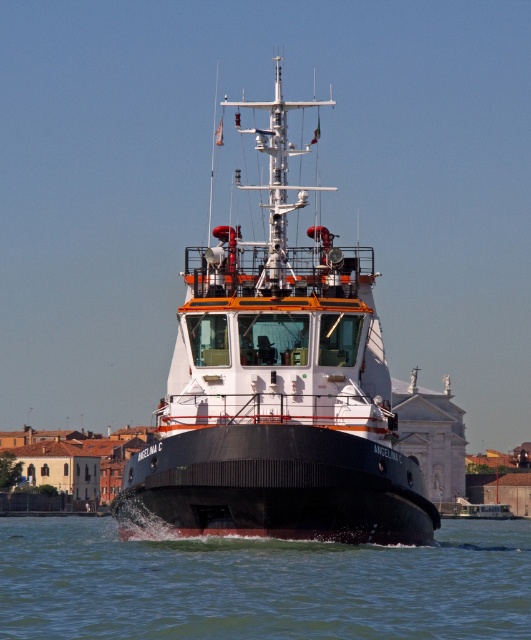
Question: Is matte white ship at center positioned behind brown matte water at lower center?

Choices:
 (A) yes
 (B) no

Answer: (A)

Question: Which point is closer to the camera?

Choices:
 (A) (450, 556)
 (B) (310, 465)

Answer: (B)

Question: Does matte white ship at center come in front of brown matte water at lower center?

Choices:
 (A) yes
 (B) no

Answer: (B)

Question: Does matte white ship at center have a greater width compared to brown matte water at lower center?

Choices:
 (A) no
 (B) yes

Answer: (A)